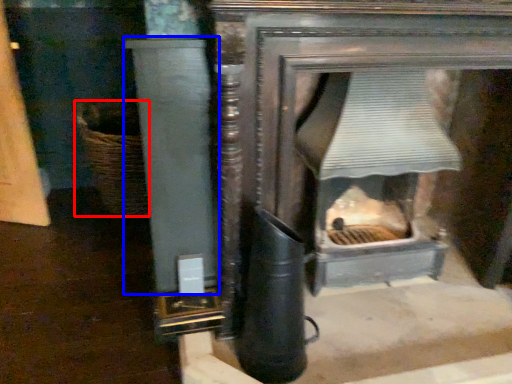
Question: Which point is closer to the camera, basket (highlighted by a red box) or pillar (highlighted by a blue box)?

Choices:
 (A) basket
 (B) pillar

Answer: (B)